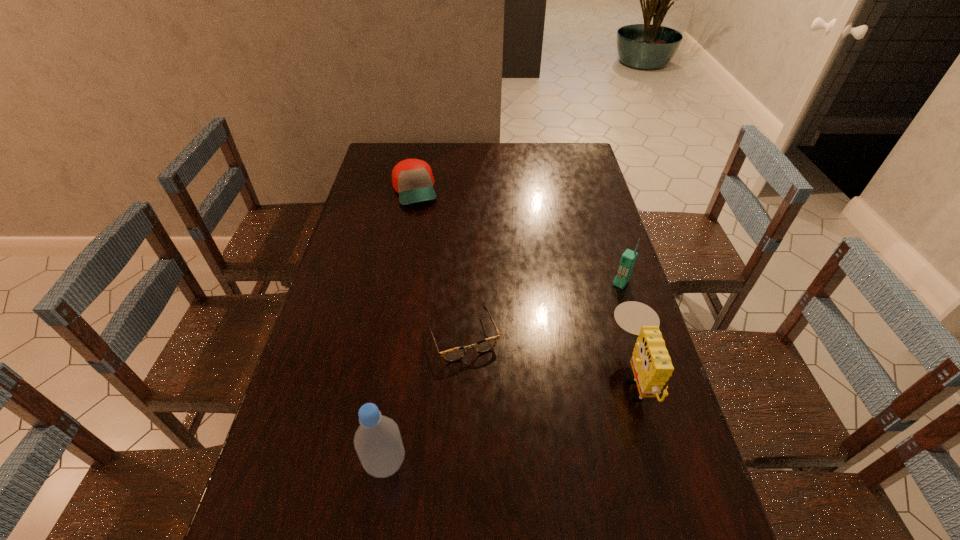
This screenshot has height=540, width=960. I want to click on vacant space located 0.330m on the keypad of the cellular telephone, so click(x=561, y=361).

Where is `object that is at the left edge`? object that is at the left edge is located at coordinates (412, 179).

The height and width of the screenshot is (540, 960). Identify the location of sponge present at the right edge. (652, 367).

You are a GUI agent. You are given a task and a screenshot of the screen. Output one action in this format:
    pyautogui.click(x=<x>, y=<y>)
    Task: Click on the cellular telephone present at the right edge
    Image resolution: width=960 pixels, height=540 pixels.
    Given the screenshot: What is the action you would take?
    pyautogui.click(x=628, y=258)

In the image, there is a desktop. At what (x,y) coordinates should I click in order to perform the action: click on vacant space at the far edge. Please return your answer as a coordinate pair (x, y). Looking at the image, I should click on (472, 161).

Where is `vacant space at the left edge`? The width and height of the screenshot is (960, 540). vacant space at the left edge is located at coordinates (372, 233).

Image resolution: width=960 pixels, height=540 pixels. I want to click on free space at the right edge, so click(597, 300).

Where is `blank space at the far right corner`? blank space at the far right corner is located at coordinates (550, 154).

This screenshot has height=540, width=960. I want to click on free space between the second farthest object and the spectacles, so click(541, 310).

At what (x,y) coordinates should I click in order to perform the action: click on free space between the fourth tallest object and the bottle. Please return your answer as a coordinate pair (x, y). The image size is (960, 540). Looking at the image, I should click on (400, 327).